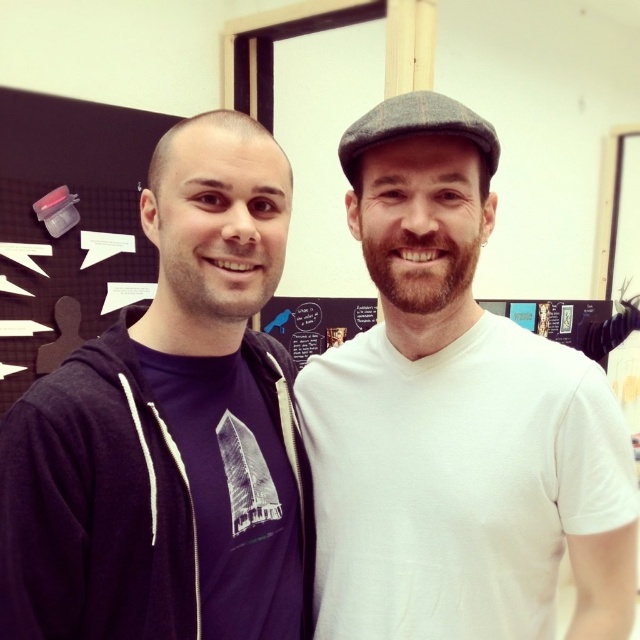
Does white matte cap at upper center have a smaller size compared to purple cotton t-shirt at left?

No.

Identify the location of white matte cap at upper center. The width and height of the screenshot is (640, 640). [454, 419].